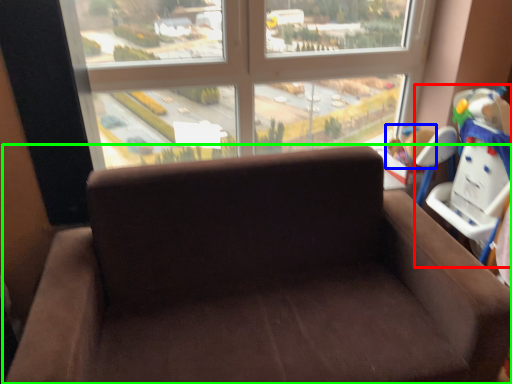
Question: Considering the real-world distances, which object is farthest from baby carriage (highlighted by a red box)? child (highlighted by a blue box) or studio couch (highlighted by a green box)?

Choices:
 (A) child
 (B) studio couch

Answer: (B)